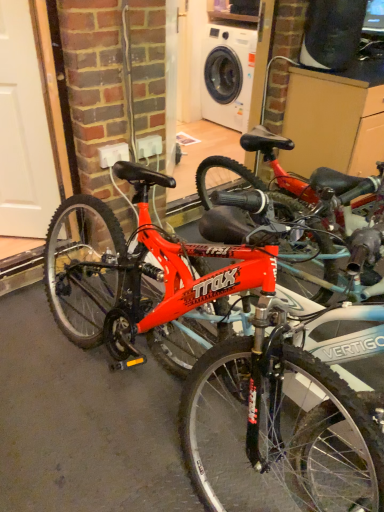
Question: Considering the positions of shiny red bicycle at center and white glossy garage door at left in the image, is shiny red bicycle at center taller or shorter than white glossy garage door at left?

Choices:
 (A) tall
 (B) short

Answer: (B)

Question: From a real-world perspective, is shiny red bicycle at center positioned above or below white glossy garage door at left?

Choices:
 (A) below
 (B) above

Answer: (A)

Question: Looking at their shapes, would you say shiny red bicycle at center is wider or thinner than white glossy garage door at left?

Choices:
 (A) wide
 (B) thin

Answer: (A)

Question: Do you think white glossy garage door at left is within shiny red bicycle at center, or outside of it?

Choices:
 (A) inside
 (B) outside

Answer: (B)

Question: Considering the positions of point (0, 229) and point (178, 364), is point (0, 229) closer or farther from the camera than point (178, 364)?

Choices:
 (A) farther
 (B) closer

Answer: (A)

Question: Considering the positions of white glossy garage door at left and shiny red bicycle at center in the image, is white glossy garage door at left bigger or smaller than shiny red bicycle at center?

Choices:
 (A) big
 (B) small

Answer: (B)

Question: Visually, is white glossy garage door at left positioned to the left or to the right of shiny red bicycle at center?

Choices:
 (A) left
 (B) right

Answer: (A)